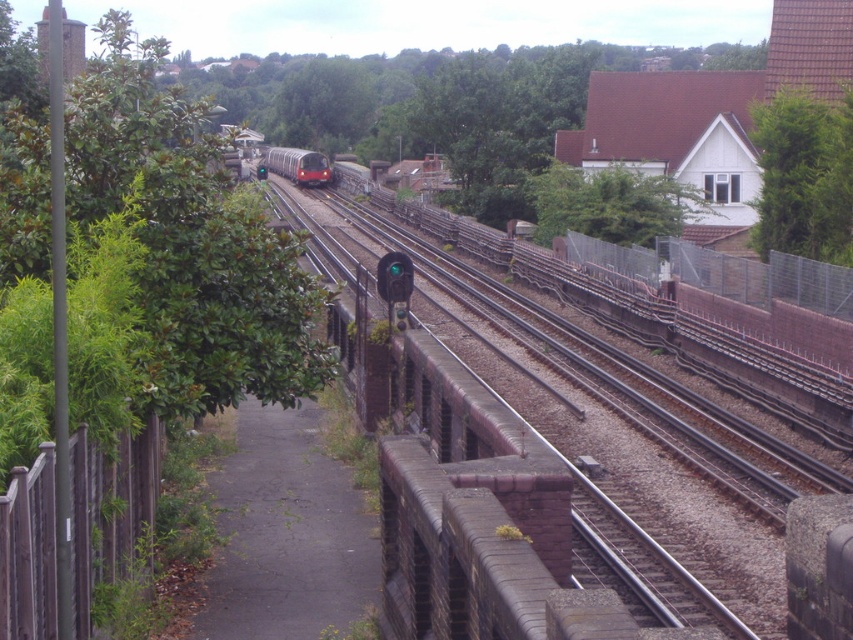
Question: Which object is closer to the camera taking this photo?

Choices:
 (A) green leafy tree at upper right
 (B) green leafy tree at upper center
 (C) smooth metal train track at center

Answer: (C)

Question: Among these points, which one is nearest to the camera?

Choices:
 (A) (619, 237)
 (B) (134, 538)
 (C) (799, 218)

Answer: (B)

Question: Is green leafy tree at upper center positioned behind red metallic train at center?

Choices:
 (A) yes
 (B) no

Answer: (B)

Question: Where is brown wooden fence at left located in relation to red metallic train at center in the image?

Choices:
 (A) right
 (B) left

Answer: (A)

Question: Does smooth metal train track at center have a greater width compared to green leafy tree at upper center?

Choices:
 (A) no
 (B) yes

Answer: (B)

Question: Among these objects, which one is farthest from the camera?

Choices:
 (A) brown wooden fence at left
 (B) red metallic train at center
 (C) smooth metal train track at center
 (D) green leafy tree at upper right

Answer: (B)